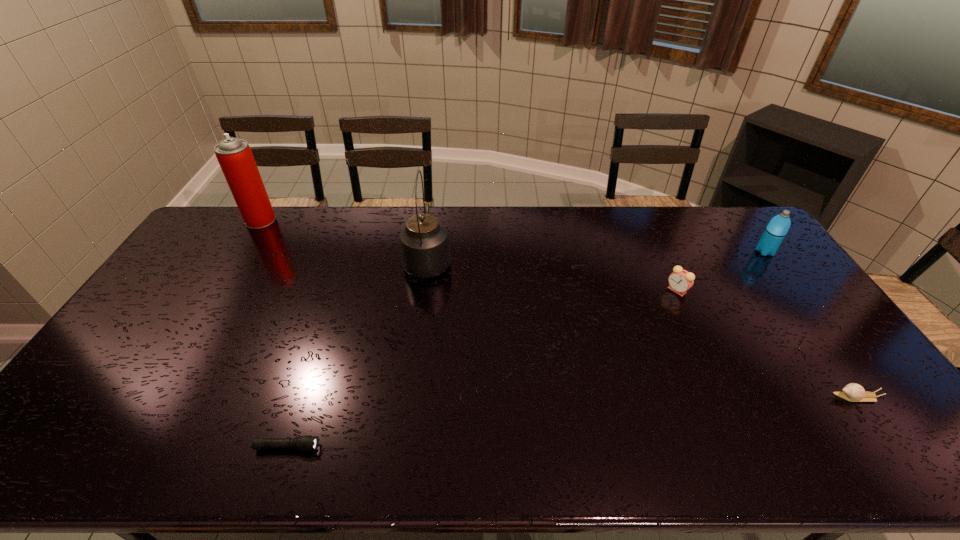
Identify the location of vacant space at the near edge of the desktop. (466, 467).

Locate an element on the screen. This screenshot has height=540, width=960. vacant position at the left edge of the desktop is located at coordinates (57, 430).

Where is `free space at the right edge of the desktop`? The width and height of the screenshot is (960, 540). free space at the right edge of the desktop is located at coordinates (780, 330).

In the image, there is a desktop. Where is `free space at the far left corner`? Image resolution: width=960 pixels, height=540 pixels. free space at the far left corner is located at coordinates (239, 213).

Where is `vacant area between the fourth object from left to right and the thermos bottle`? vacant area between the fourth object from left to right and the thermos bottle is located at coordinates (721, 271).

The width and height of the screenshot is (960, 540). In order to click on free space between the nearest object and the escargot in this screenshot , I will do point(571,422).

Where is `free area in between the fourth object from right to left and the leftmost object`? The height and width of the screenshot is (540, 960). free area in between the fourth object from right to left and the leftmost object is located at coordinates (344, 240).

Image resolution: width=960 pixels, height=540 pixels. I want to click on free space between the flashlight and the fifth farthest object, so click(571, 422).

The width and height of the screenshot is (960, 540). I want to click on empty space between the aerosol can and the third object from right to left, so click(x=468, y=255).

Identify the location of free space between the alarm clock and the thermos bottle. This screenshot has height=540, width=960. (721, 271).